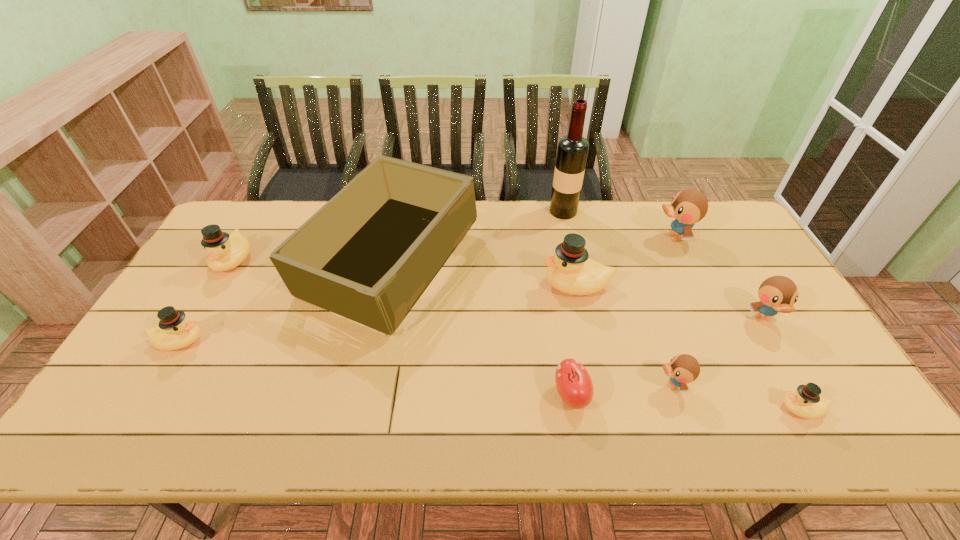
Identify the location of wine bottle. (572, 151).

The image size is (960, 540). Find the location of `brown box`. brown box is located at coordinates (369, 254).

Where is `box`? This screenshot has height=540, width=960. box is located at coordinates (369, 254).

Locate an element on the screen. This screenshot has height=540, width=960. the second blue duck from left to right is located at coordinates (689, 206).

The width and height of the screenshot is (960, 540). In order to click on the farthest blue duck in this screenshot , I will do tap(689, 206).

Identify the location of the biggest yellow duck. (570, 271).

Find the location of a particular element. the third yellow duck from left to right is located at coordinates (570, 271).

Find the location of a particular element. The width and height of the screenshot is (960, 540). the third smallest yellow duck is located at coordinates (225, 252).

Locate an element on the screen. The image size is (960, 540). the second biggest blue duck is located at coordinates (777, 294).

The image size is (960, 540). I want to click on the second nearest blue duck, so click(777, 294).